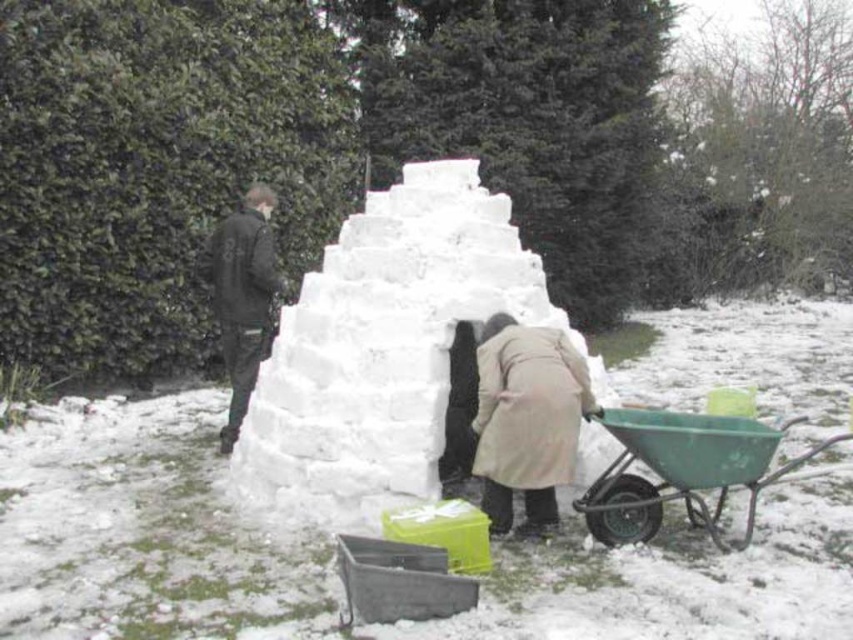
Question: Is white snow igloo at center to the left of green plastic cart at lower right from the viewer's perspective?

Choices:
 (A) no
 (B) yes

Answer: (B)

Question: Among these points, which one is nearest to the camera?

Choices:
 (A) (653, 467)
 (B) (125, 198)

Answer: (A)

Question: Which point is farther to the camera?

Choices:
 (A) pos(540,449)
 (B) pos(575,429)
 (C) pos(804,452)
 (D) pos(239,380)

Answer: (D)

Question: Is green leafy hedge at upper left to the right of light beige coat at center from the viewer's perspective?

Choices:
 (A) yes
 (B) no

Answer: (B)

Question: Is green leafy hedge at upper left wider than green plastic cart at lower right?

Choices:
 (A) no
 (B) yes

Answer: (B)

Question: Which point is farther to the camera?

Choices:
 (A) green leafy hedge at upper left
 (B) green plastic cart at lower right
 (C) white snow igloo at center
 (D) light beige coat at center

Answer: (A)